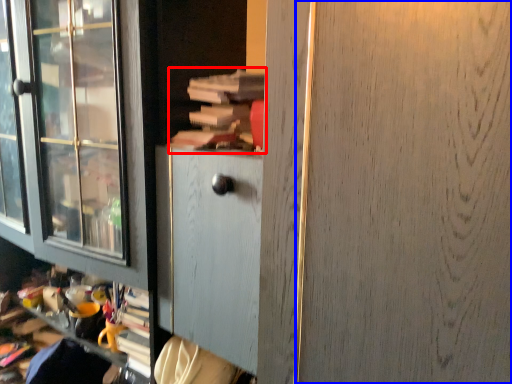
Question: Among these objects, which one is farthest to the camera, book (highlighted by a red box) or screen door (highlighted by a blue box)?

Choices:
 (A) book
 (B) screen door

Answer: (A)